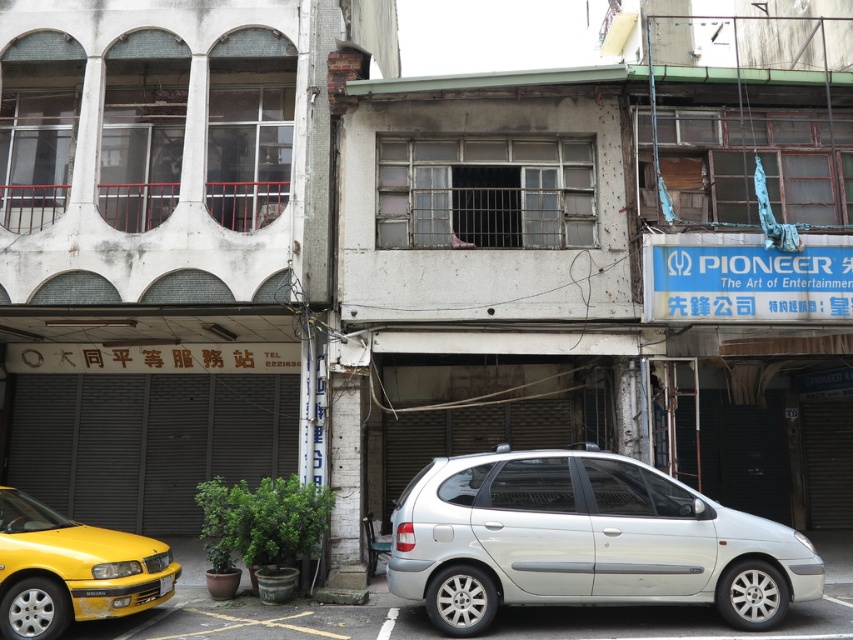
Question: Considering the real-world distances, which object is closest to the yellow plastic license plate at lower left?

Choices:
 (A) silver metallic minivan at center
 (B) shiny yellow taxi at lower left

Answer: (B)

Question: Which point is closer to the camera taking this photo?

Choices:
 (A) (91, 560)
 (B) (173, 582)
 (C) (544, 554)

Answer: (A)

Question: Is silver metallic minivan at center further to the viewer compared to yellow plastic license plate at lower left?

Choices:
 (A) yes
 (B) no

Answer: (B)

Question: Does silver metallic minivan at center have a lesser width compared to shiny yellow taxi at lower left?

Choices:
 (A) yes
 (B) no

Answer: (B)

Question: Which point is farther to the camera?

Choices:
 (A) shiny yellow taxi at lower left
 (B) yellow plastic license plate at lower left
 (C) silver metallic minivan at center

Answer: (B)

Question: Is silver metallic minivan at center above yellow plastic license plate at lower left?

Choices:
 (A) yes
 (B) no

Answer: (A)